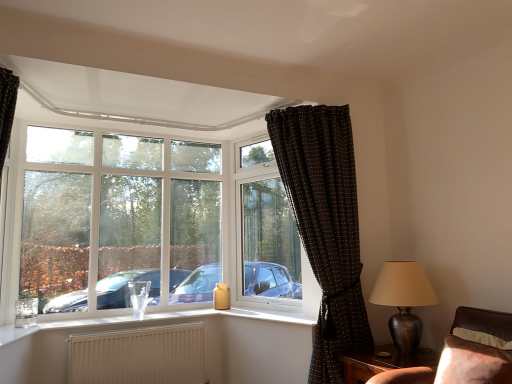
Question: Does brown dotted fabric curtain at upper right, which is the 1th curtain from right to left, come in front of white plastic window at upper left?

Choices:
 (A) no
 (B) yes

Answer: (B)

Question: Considering the relative sizes of brown dotted fabric curtain at upper right, which is the 1th curtain from right to left, and white plastic window at upper left in the image provided, is brown dotted fabric curtain at upper right, which is the 1th curtain from right to left, thinner than white plastic window at upper left?

Choices:
 (A) no
 (B) yes

Answer: (A)

Question: Can you confirm if brown dotted fabric curtain at upper right, which is the 1th curtain from right to left, is taller than white plastic window at upper left?

Choices:
 (A) yes
 (B) no

Answer: (A)

Question: Is brown dotted fabric curtain at upper right, which is the 1th curtain from right to left, positioned far away from white plastic window at upper left?

Choices:
 (A) yes
 (B) no

Answer: (A)

Question: From the image's perspective, is brown dotted fabric curtain at upper right, which is the 1th curtain from right to left, beneath white plastic window at upper left?

Choices:
 (A) no
 (B) yes

Answer: (B)

Question: Can you confirm if brown dotted fabric curtain at upper right, which is the second curtain from left to right, is smaller than white plastic window at upper left?

Choices:
 (A) yes
 (B) no

Answer: (B)

Question: Is white textured radiator at lower center taller than brown wooden table at lower right?

Choices:
 (A) yes
 (B) no

Answer: (A)

Question: Is white textured radiator at lower center positioned with its back to brown wooden table at lower right?

Choices:
 (A) yes
 (B) no

Answer: (B)

Question: Is white textured radiator at lower center touching brown wooden table at lower right?

Choices:
 (A) yes
 (B) no

Answer: (B)

Question: Can you confirm if white textured radiator at lower center is wider than brown wooden table at lower right?

Choices:
 (A) no
 (B) yes

Answer: (A)

Question: From a real-world perspective, does white textured radiator at lower center stand above brown wooden table at lower right?

Choices:
 (A) yes
 (B) no

Answer: (A)

Question: Is white textured radiator at lower center far from brown wooden table at lower right?

Choices:
 (A) yes
 (B) no

Answer: (A)

Question: Is brown leather couch at lower right a part of white textured radiator at lower center?

Choices:
 (A) yes
 (B) no

Answer: (B)